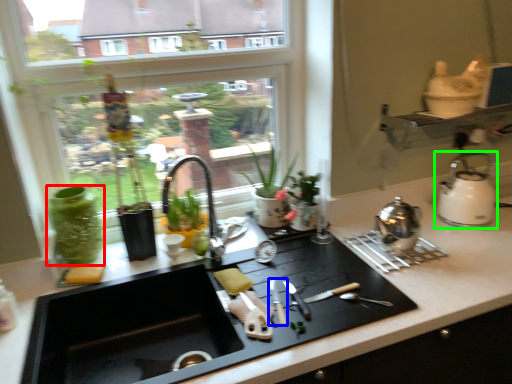
Question: Which object is the closest to the glass vase (highlighted by a red box)? Choose among these: knife (highlighted by a blue box) or kitchen appliance (highlighted by a green box).

Choices:
 (A) knife
 (B) kitchen appliance

Answer: (A)